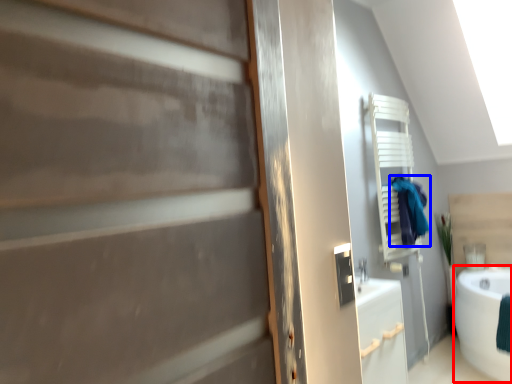
Question: Which of the following is the closest to the observer, bath (highlighted by a red box) or laundry (highlighted by a blue box)?

Choices:
 (A) bath
 (B) laundry

Answer: (A)